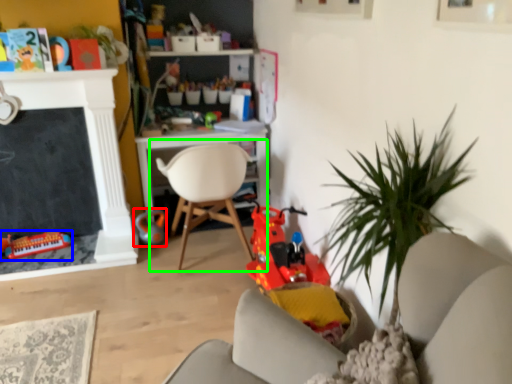
Question: Based on their relative distances, which object is nearer to toy (highlighted by a red box)? Choose from toy (highlighted by a blue box) and chair (highlighted by a green box).

Choices:
 (A) toy
 (B) chair

Answer: (B)